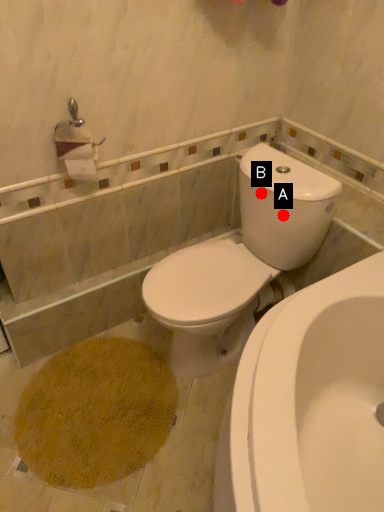
Question: Two points are circled on the image, labeled by A and B beside each circle. Which point is closer to the camera taking this photo?

Choices:
 (A) A is closer
 (B) B is closer

Answer: (A)